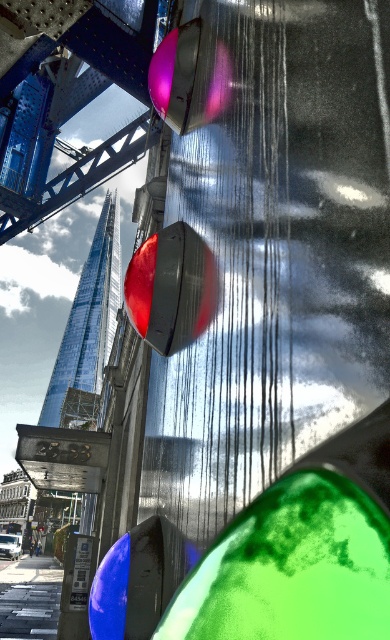
Which is above, matte black traffic light at center or matte black traffic light at upper center?

matte black traffic light at upper center is above.

Does matte black traffic light at center appear under matte black traffic light at upper center?

Indeed, matte black traffic light at center is positioned under matte black traffic light at upper center.

This screenshot has height=640, width=390. Describe the element at coordinates (171, 289) in the screenshot. I see `matte black traffic light at center` at that location.

You are a GUI agent. You are given a task and a screenshot of the screen. Output one action in this format:
    pyautogui.click(x=<x>, y=<y>)
    Task: Click on the matte black traffic light at center
    The width and height of the screenshot is (390, 640).
    Given the screenshot: What is the action you would take?
    pyautogui.click(x=171, y=289)